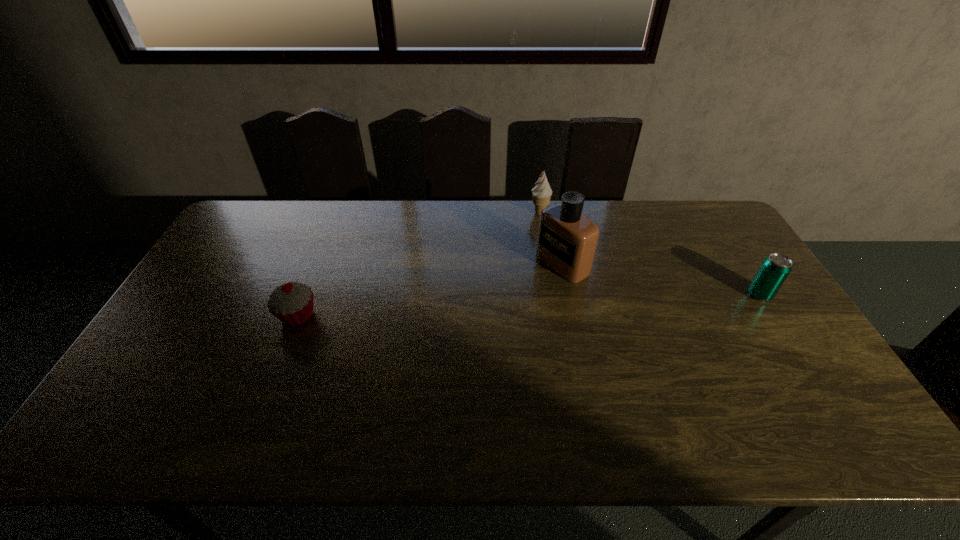
In order to click on free area in between the perfume and the cupcake in this screenshot , I will do `click(430, 290)`.

Where is `object that is the nearest to the icecream`? The width and height of the screenshot is (960, 540). object that is the nearest to the icecream is located at coordinates (567, 240).

Where is `object that is the closest to the perfume`? object that is the closest to the perfume is located at coordinates (542, 192).

Locate an element on the screen. free space that satisfies the following two spatial constraints: 1. on the front side of the beer can; 2. on the left side of the tallest object is located at coordinates (568, 294).

This screenshot has width=960, height=540. I want to click on free location that satisfies the following two spatial constraints: 1. on the front side of the farthest object; 2. on the left side of the beer can, so pyautogui.click(x=553, y=294).

The width and height of the screenshot is (960, 540). I want to click on free space that satisfies the following two spatial constraints: 1. on the front side of the tallest object; 2. on the right side of the rightmost object, so click(x=568, y=294).